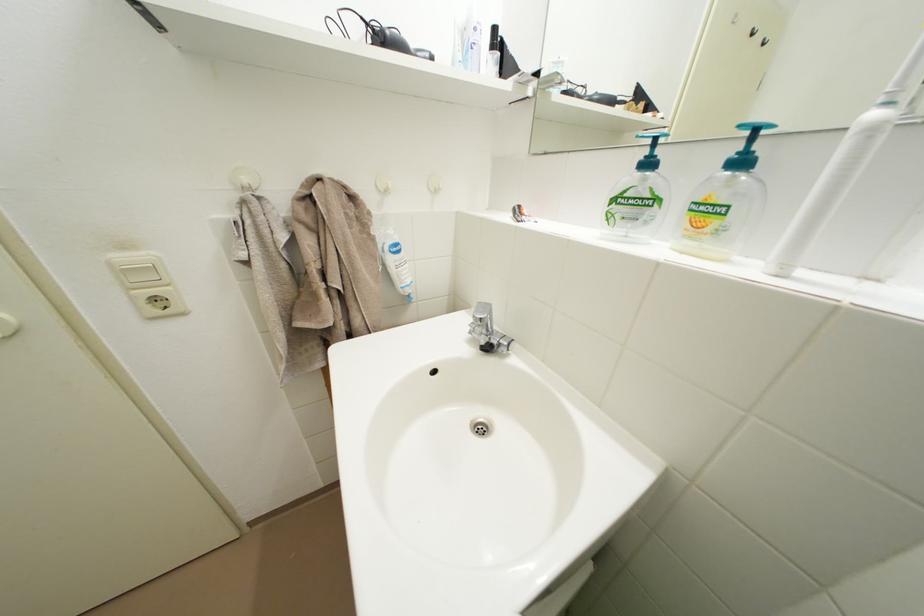
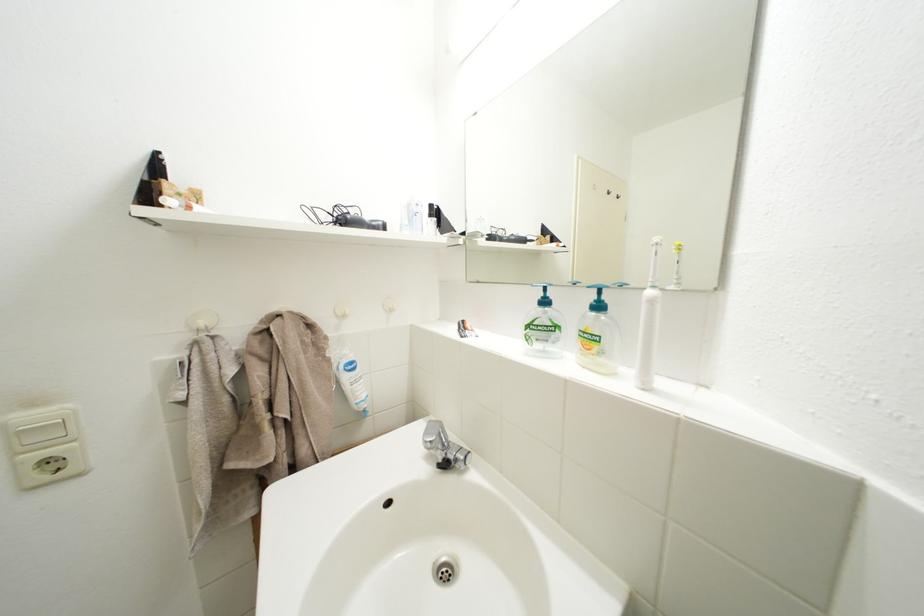
Where in the second image is the point corresponding to [749,153] from the first image?

(604, 302)